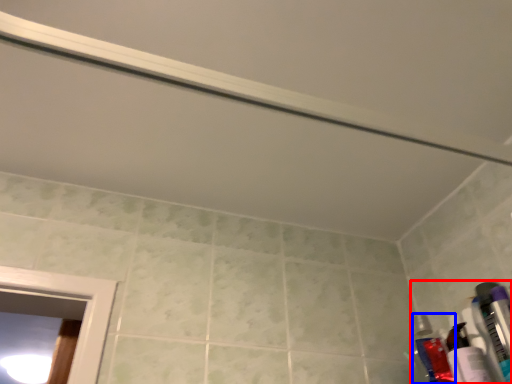
Question: Which point is further to the camera, toiletry (highlighted by a red box) or toiletry (highlighted by a blue box)?

Choices:
 (A) toiletry
 (B) toiletry

Answer: (B)